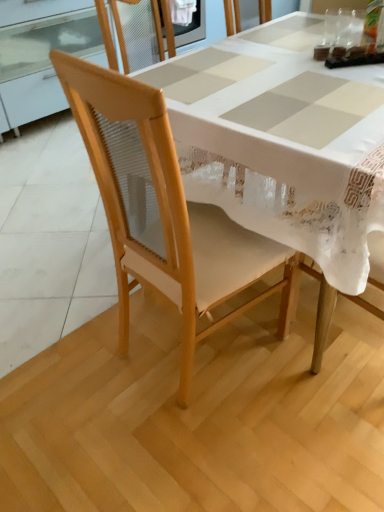
Locate an element on the screen. The width and height of the screenshot is (384, 512). free area behind transparent glass at upper center, which ranks as the second tableware in left-to-right order is located at coordinates (344, 24).